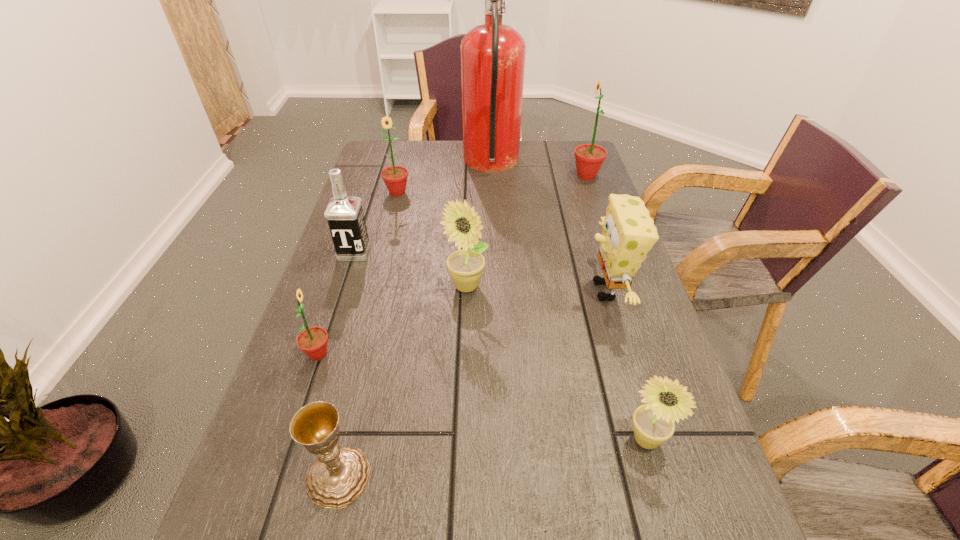
This screenshot has width=960, height=540. Find the location of `fire extinguisher present at the far edge`. fire extinguisher present at the far edge is located at coordinates (492, 55).

Locate an element on the screen. sunflower that is at the far edge is located at coordinates (589, 157).

The height and width of the screenshot is (540, 960). I want to click on vodka that is at the left edge, so click(344, 214).

Locate an element on the screen. This screenshot has height=540, width=960. chalice situated at the left edge is located at coordinates (340, 475).

This screenshot has height=540, width=960. Find the location of `sponge present at the right edge`. sponge present at the right edge is located at coordinates (628, 232).

Locate an element on the screen. object that is at the far right corner is located at coordinates (589, 157).

This screenshot has height=540, width=960. In order to click on vacant space at the left edge of the desktop in this screenshot , I will do `click(311, 311)`.

You are a GUI agent. You are given a task and a screenshot of the screen. Output one action in this format:
    pyautogui.click(x=<x>, y=<y>)
    Task: Click on the vacant space at the right edge
    This screenshot has height=540, width=960.
    Given the screenshot: What is the action you would take?
    pyautogui.click(x=586, y=220)

Locate an element on the screen. This screenshot has width=960, height=540. vacant area at the far right corner is located at coordinates coord(550,164).

The width and height of the screenshot is (960, 540). In order to click on vacant area between the nearest sunflower and the seventh farthest object in this screenshot , I will do `click(482, 397)`.